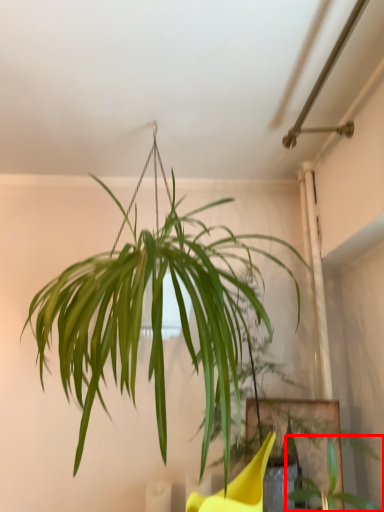
Question: From the image's perspective, what is the correct spatial positioning of plant (annotated by the red box) in reference to houseplant?

Choices:
 (A) above
 (B) below

Answer: (B)